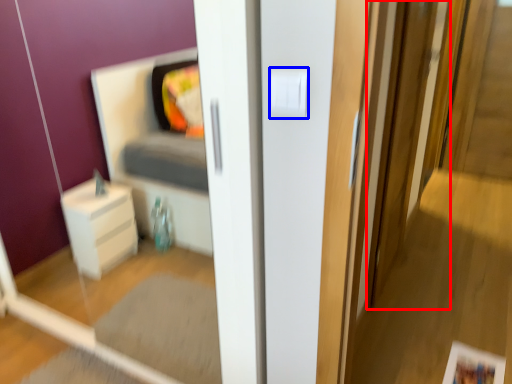
Question: Which of the following is the farthest to the observer, screen door (highlighted by a red box) or light switch (highlighted by a blue box)?

Choices:
 (A) screen door
 (B) light switch

Answer: (A)